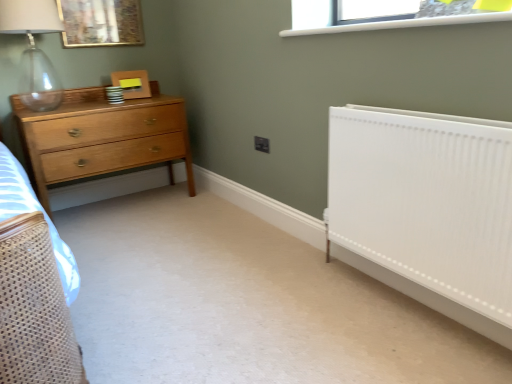
Question: From their relative heights in the image, would you say gold-framed picture at upper left is taller or shorter than clear glass window at upper center?

Choices:
 (A) tall
 (B) short

Answer: (A)

Question: In terms of size, does gold-framed picture at upper left appear bigger or smaller than clear glass window at upper center?

Choices:
 (A) small
 (B) big

Answer: (A)

Question: Which object is positioned closest to the gold-framed picture at upper left?

Choices:
 (A) white smooth radiator at right
 (B) light brown wood chest of drawers at left
 (C) transparent glass lamp at upper left
 (D) clear glass window at upper center

Answer: (C)

Question: Estimate the real-world distances between objects in this image. Which object is farther from the light brown wood chest of drawers at left?

Choices:
 (A) clear glass window at upper center
 (B) transparent glass lamp at upper left
 (C) white smooth radiator at right
 (D) gold-framed picture at upper left

Answer: (C)